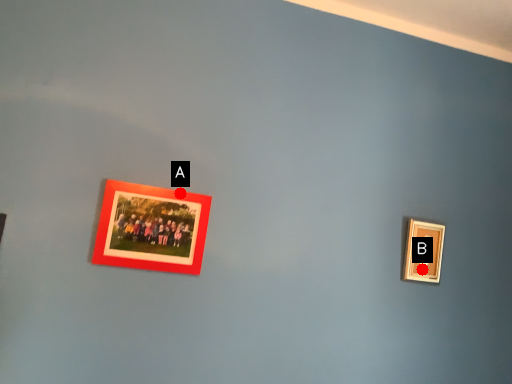
Question: Two points are circled on the image, labeled by A and B beside each circle. Which point is farther to the camera?

Choices:
 (A) A is further
 (B) B is further

Answer: (B)